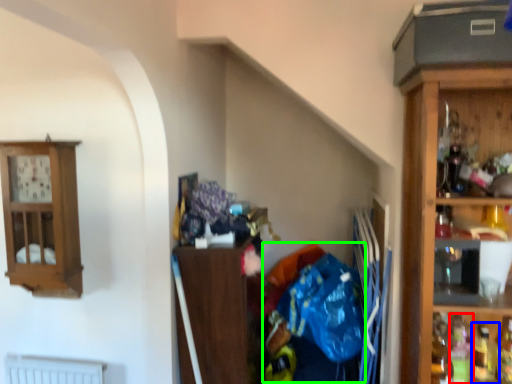
Question: Which object is positioned farthest from bottle (highlighted by a red box)? Select from bottle (highlighted by a blue box) and waste (highlighted by a green box).

Choices:
 (A) bottle
 (B) waste

Answer: (B)